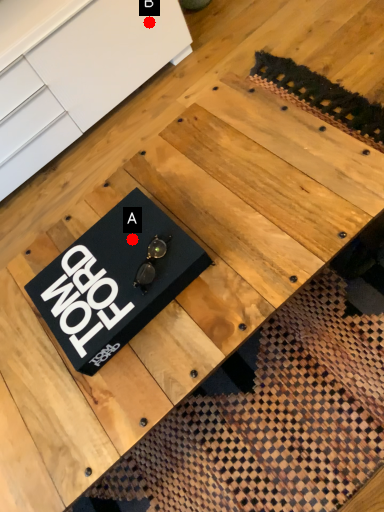
Question: Two points are circled on the image, labeled by A and B beside each circle. Which point is closer to the camera?

Choices:
 (A) A is closer
 (B) B is closer

Answer: (A)